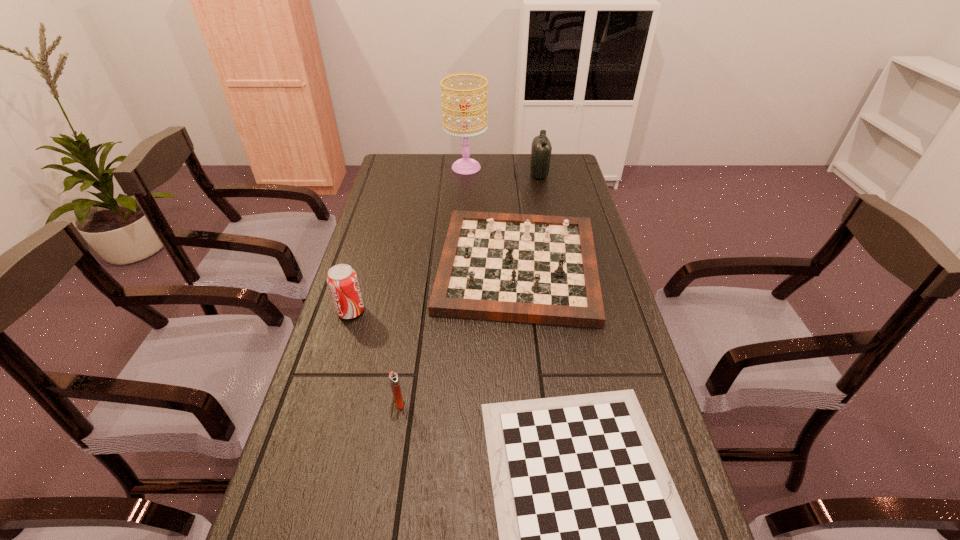
Find the location of a particular element. The height and width of the screenshot is (540, 960). empty space that is in between the third tallest object and the lampshade is located at coordinates (408, 239).

You are a GUI agent. You are given a task and a screenshot of the screen. Output one action in this format:
    pyautogui.click(x=<x>, y=<y>)
    Task: Click on the vacant region between the fifth shortest object and the lampshade
    
    Given the screenshot: What is the action you would take?
    503,171

This screenshot has width=960, height=540. I want to click on free spot between the tallest object and the igniter, so click(433, 285).

The width and height of the screenshot is (960, 540). Identify the location of the second closest object to the taller chessboard. (594, 539).

Choose which object is the second nearest neighbor to the bottle. Please provide its 2D coordinates. Your answer should be formatted as a tuple, i.e. [(x, y)], where the tuple contains the x and y coordinates of a point satisfying the conditions above.

[(542, 269)]

Image resolution: width=960 pixels, height=540 pixels. Find the location of `vacant area in the image that satisfies the following two spatial constraints: 1. on the logo side of the igniter; 2. on the left side of the third tallest object`. vacant area in the image that satisfies the following two spatial constraints: 1. on the logo side of the igniter; 2. on the left side of the third tallest object is located at coordinates (324, 402).

You are a GUI agent. You are given a task and a screenshot of the screen. Output one action in this format:
    pyautogui.click(x=<x>, y=<y>)
    Task: Click on the vacant space that satisfies the following two spatial constraints: 1. on the logo side of the fifth object from right to left; 2. on the left side of the fourth shortest object
    This screenshot has height=540, width=960.
    Given the screenshot: What is the action you would take?
    pyautogui.click(x=324, y=402)

Where is `free spot that satisfies the following two spatial constraints: 1. on the front side of the bottle; 2. on the logo side of the third tallest object`? free spot that satisfies the following two spatial constraints: 1. on the front side of the bottle; 2. on the logo side of the third tallest object is located at coordinates 566,311.